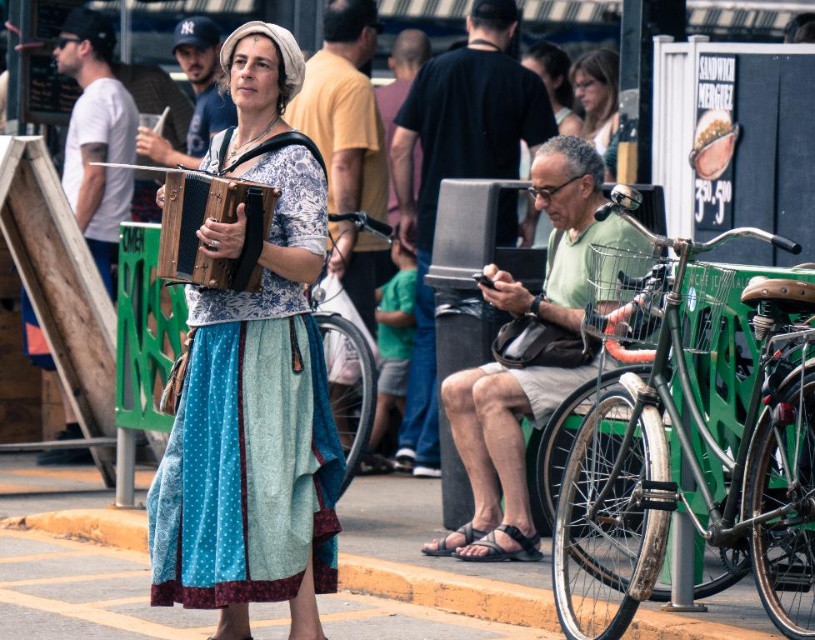
Question: Which of the following is the closest to the observer?

Choices:
 (A) smooth concrete pavement at center
 (B) shiny silver bicycle at right

Answer: (A)

Question: Considering the relative positions of wooden accordion at center and matte black hair at upper center in the image provided, where is wooden accordion at center located with respect to matte black hair at upper center?

Choices:
 (A) below
 (B) above

Answer: (A)

Question: Considering the real-world distances, which object is closest to the woodenobject at center?

Choices:
 (A) shiny silver bicycle at right
 (B) matte black hair at upper center
 (C) silver metallic bicycle at center
 (D) smooth concrete pavement at center

Answer: (A)

Question: Can you confirm if shiny silver bicycle at right is bigger than woodenobject at center?

Choices:
 (A) yes
 (B) no

Answer: (B)

Question: Does smooth concrete pavement at center have a smaller size compared to matte black hair at upper center?

Choices:
 (A) no
 (B) yes

Answer: (A)

Question: Which object is farther from the camera taking this photo?

Choices:
 (A) smooth concrete pavement at center
 (B) shiny silver bicycle at right

Answer: (B)